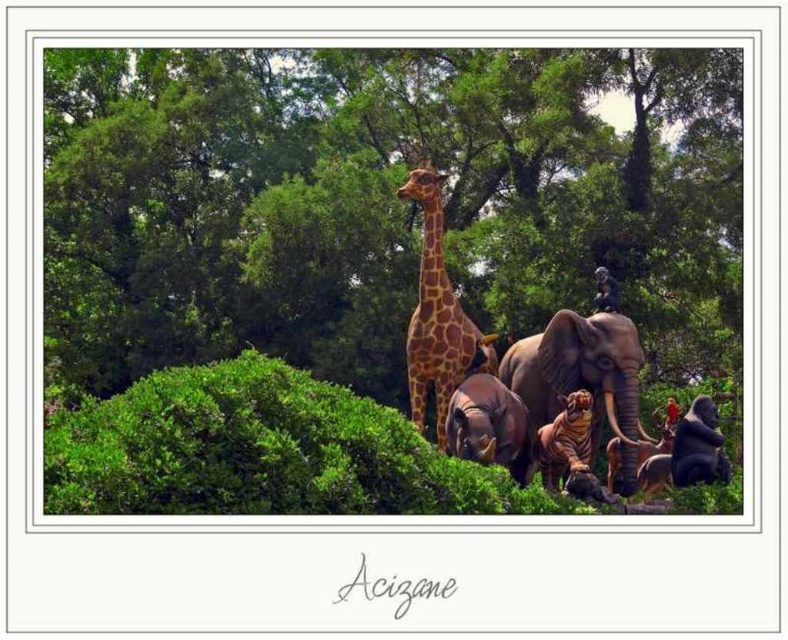
Is rustic brown elephant at center to the left of shiny brown tiger at center from the viewer's perspective?

In fact, rustic brown elephant at center is to the right of shiny brown tiger at center.

Is point (634, 374) closer to viewer compared to point (571, 449)?

No, it is not.

Locate an element on the screen. rustic brown elephant at center is located at coordinates (582, 374).

Who is more forward, (418,403) or (591,451)?

Point (591,451) is in front.

Between point (429, 228) and point (582, 410), which one is positioned behind?

The point (429, 228) is more distant.

Where is `brown spotted giraffe at center`? brown spotted giraffe at center is located at coordinates coord(437,314).

Based on the photo, can you confirm if brown spotted giraffe at center is positioned above brown matte elephant at center?

Yes.

Is brown spotted giraffe at center positioned before brown matte elephant at center?

No, brown spotted giraffe at center is behind brown matte elephant at center.

What do you see at coordinates (437, 314) in the screenshot? Image resolution: width=788 pixels, height=640 pixels. I see `brown spotted giraffe at center` at bounding box center [437, 314].

At what (x,y) coordinates should I click in order to perform the action: click on brown spotted giraffe at center. Please return your answer as a coordinate pair (x, y). Looking at the image, I should click on (437, 314).